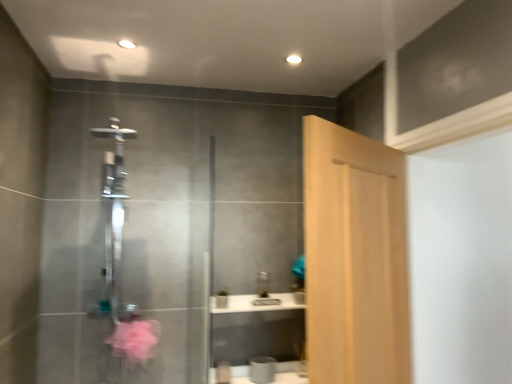
This screenshot has width=512, height=384. What do you see at coordinates (354, 257) in the screenshot?
I see `light wood door at center` at bounding box center [354, 257].

I want to click on light wood door at center, so 354,257.

What is the approximate height of light wood door at center?

It is 1.05 meters.

This screenshot has width=512, height=384. What do you see at coordinates (113, 218) in the screenshot? I see `clear glass shower at center` at bounding box center [113, 218].

What is the approximate width of clear glass shower at center?

clear glass shower at center is 20.49 inches wide.

The image size is (512, 384). Find the location of `clear glass shower at center`. clear glass shower at center is located at coordinates (113, 218).

Measure the distance between clear glass shower at center and camera.

clear glass shower at center is 6.85 feet away from camera.

This screenshot has width=512, height=384. In order to click on light wood door at center in this screenshot , I will do `click(354, 257)`.

Which is more to the right, light wood door at center or clear glass shower at center?

From the viewer's perspective, light wood door at center appears more on the right side.

Is light wood door at center in front of or behind clear glass shower at center in the image?

In the image, light wood door at center appears in front of clear glass shower at center.

Considering the points (311, 191) and (117, 241), which point is behind, point (311, 191) or point (117, 241)?

Point (117, 241)

From the image's perspective, which one is positioned higher, light wood door at center or clear glass shower at center?

From the image's view, light wood door at center is above.

From a real-world perspective, is light wood door at center below clear glass shower at center?

Yes, from a real-world perspective, light wood door at center is beneath clear glass shower at center.

Considering the relative sizes of light wood door at center and clear glass shower at center in the image provided, is light wood door at center thinner than clear glass shower at center?

Yes.

Considering the sizes of objects light wood door at center and clear glass shower at center in the image provided, who is taller, light wood door at center or clear glass shower at center?

clear glass shower at center.

Which of these two, light wood door at center or clear glass shower at center, is smaller?

clear glass shower at center.

Is light wood door at center outside of clear glass shower at center?

Yes, light wood door at center is outside of clear glass shower at center.

Based on the photo, is light wood door at center placed right next to clear glass shower at center?

No, light wood door at center is not with clear glass shower at center.

Is light wood door at center oriented towards clear glass shower at center?

No, light wood door at center does not turn towards clear glass shower at center.

The image size is (512, 384). In the image, there is a clear glass shower at center. Find the location of `door below it (from a real-world perspective)`. door below it (from a real-world perspective) is located at coordinates (354, 257).

Can you confirm if clear glass shower at center is positioned to the left of light wood door at center?

Yes.

Is clear glass shower at center in front of light wood door at center?

No.

Which is closer to the camera, (110, 304) or (362, 258)?

Point (110, 304) is farther from the camera than point (362, 258).

From the image's perspective, is clear glass shower at center above light wood door at center?

No, from the image's perspective, clear glass shower at center is not on top of light wood door at center.

From a real-world perspective, which is physically below, clear glass shower at center or light wood door at center?

light wood door at center is physically lower.

Considering the sizes of clear glass shower at center and light wood door at center in the image, is clear glass shower at center wider or thinner than light wood door at center?

Clearly, clear glass shower at center has more width compared to light wood door at center.

In the scene shown: Is clear glass shower at center shorter than light wood door at center?

In fact, clear glass shower at center may be taller than light wood door at center.

Does clear glass shower at center have a smaller size compared to light wood door at center?

Yes.

Is light wood door at center located within clear glass shower at center?

Definitely not — light wood door at center is not inside clear glass shower at center.

Is clear glass shower at center directly adjacent to light wood door at center?

No, clear glass shower at center is not beside light wood door at center.

Is clear glass shower at center aimed at light wood door at center?

No.

How distant is clear glass shower at center from light wood door at center?

They are 4.22 feet apart.

What are the coordinates of `shower below the light wood door at center (from the image's perspective)` in the screenshot? It's located at (113, 218).

I want to click on shower lying below the light wood door at center (from the image's perspective), so 113,218.

At what (x,y) coordinates should I click in order to perform the action: click on door on the right side of clear glass shower at center. Please return your answer as a coordinate pair (x, y). Looking at the image, I should click on pyautogui.click(x=354, y=257).